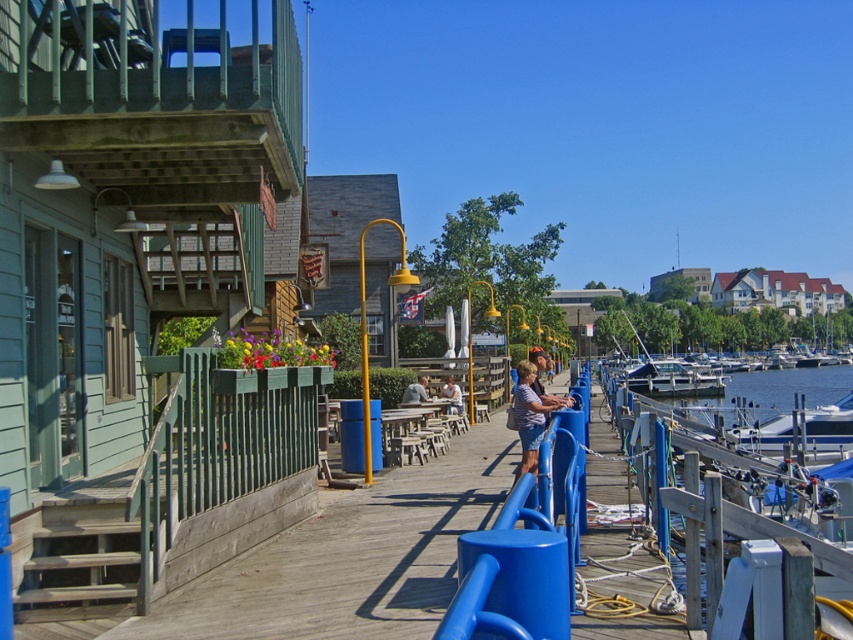
Who is more distant from viewer, (825, 404) or (706, 374)?

Positioned behind is point (706, 374).

Between white glossy boat at right and white fiberglass boat at right, which one appears on the right side from the viewer's perspective?

white fiberglass boat at right is more to the right.

Is point (805, 451) positioned behind point (645, 369)?

No, it is in front of (645, 369).

Where is `white glossy boat at right`? white glossy boat at right is located at coordinates pyautogui.click(x=802, y=432).

Who is positioned more to the left, white glossy boat at right or light blue shirt at center?

From the viewer's perspective, light blue shirt at center appears more on the left side.

From the picture: Who is taller, white glossy boat at right or light blue shirt at center?

With more height is white glossy boat at right.

Is point (740, 442) closer to camera compared to point (450, 381)?

Yes, point (740, 442) is in front of point (450, 381).

Locate an element on the screen. This screenshot has height=640, width=853. white glossy boat at right is located at coordinates pos(802,432).

Can you confirm if white fiberglass boat at right is positioned to the left of blue denim shorts at right?

Incorrect, white fiberglass boat at right is not on the left side of blue denim shorts at right.

In the scene shown: Is white fiberglass boat at right thinner than blue denim shorts at right?

In fact, white fiberglass boat at right might be wider than blue denim shorts at right.

Which is behind, point (660, 380) or point (515, 472)?

Point (660, 380)

The width and height of the screenshot is (853, 640). Find the location of `white fiberglass boat at right`. white fiberglass boat at right is located at coordinates (674, 380).